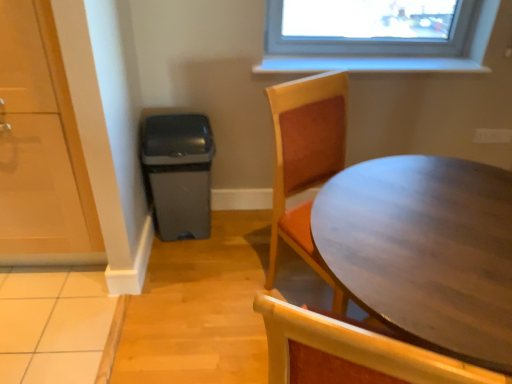
Question: Can you confirm if transparent glass door at left is taller than wooden table at right?

Choices:
 (A) no
 (B) yes

Answer: (B)

Question: Can you confirm if transparent glass door at left is shorter than wooden table at right?

Choices:
 (A) no
 (B) yes

Answer: (A)

Question: Would you say wooden table at right is part of transparent glass door at left's contents?

Choices:
 (A) no
 (B) yes

Answer: (A)

Question: Is transparent glass door at left bigger than wooden table at right?

Choices:
 (A) yes
 (B) no

Answer: (B)

Question: Can you confirm if transparent glass door at left is wider than wooden table at right?

Choices:
 (A) yes
 (B) no

Answer: (B)

Question: Is transparent glass door at left next to wooden table at right?

Choices:
 (A) no
 (B) yes

Answer: (A)

Question: Can we say wooden table at right lies outside transparent glass door at left?

Choices:
 (A) no
 (B) yes

Answer: (B)

Question: Is wooden table at right at the right side of transparent glass door at left?

Choices:
 (A) no
 (B) yes

Answer: (B)

Question: Considering the relative sizes of wooden table at right and transparent glass door at left in the image provided, is wooden table at right shorter than transparent glass door at left?

Choices:
 (A) no
 (B) yes

Answer: (B)

Question: Is wooden table at right thinner than transparent glass door at left?

Choices:
 (A) no
 (B) yes

Answer: (A)

Question: From a real-world perspective, is wooden table at right on transparent glass door at left?

Choices:
 (A) no
 (B) yes

Answer: (A)

Question: Is wooden table at right in contact with transparent glass door at left?

Choices:
 (A) no
 (B) yes

Answer: (A)

Question: Is transparent glass door at left bigger or smaller than wooden table at right?

Choices:
 (A) small
 (B) big

Answer: (A)